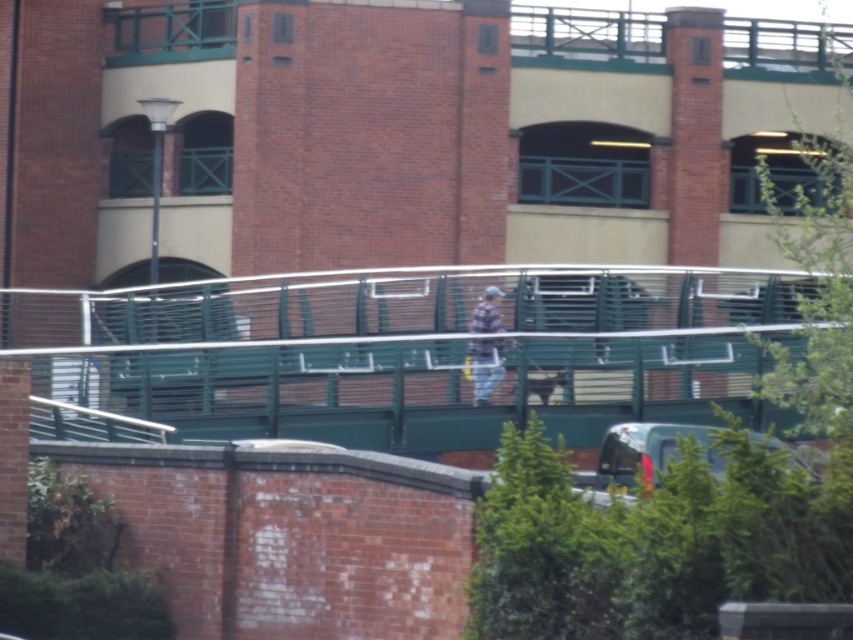
Which is more to the left, green metal pedestrian bridge at center or plaid fabric shirt at center?

From the viewer's perspective, green metal pedestrian bridge at center appears more on the left side.

Does green metal pedestrian bridge at center have a lesser width compared to plaid fabric shirt at center?

No.

This screenshot has height=640, width=853. I want to click on green metal pedestrian bridge at center, so click(395, 346).

Locate an element on the screen. This screenshot has height=640, width=853. green metal pedestrian bridge at center is located at coordinates click(395, 346).